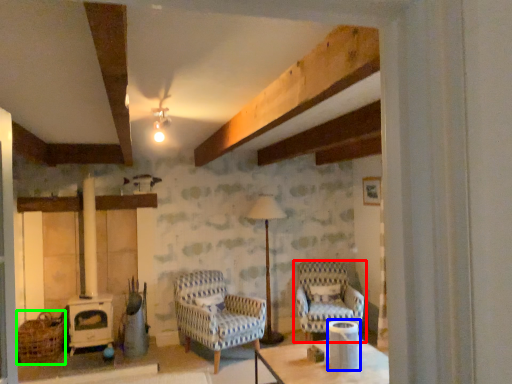
Question: Which is nearer to the chair (highlighted by a red box)? appliance (highlighted by a blue box) or basket (highlighted by a green box).

Choices:
 (A) appliance
 (B) basket

Answer: (A)